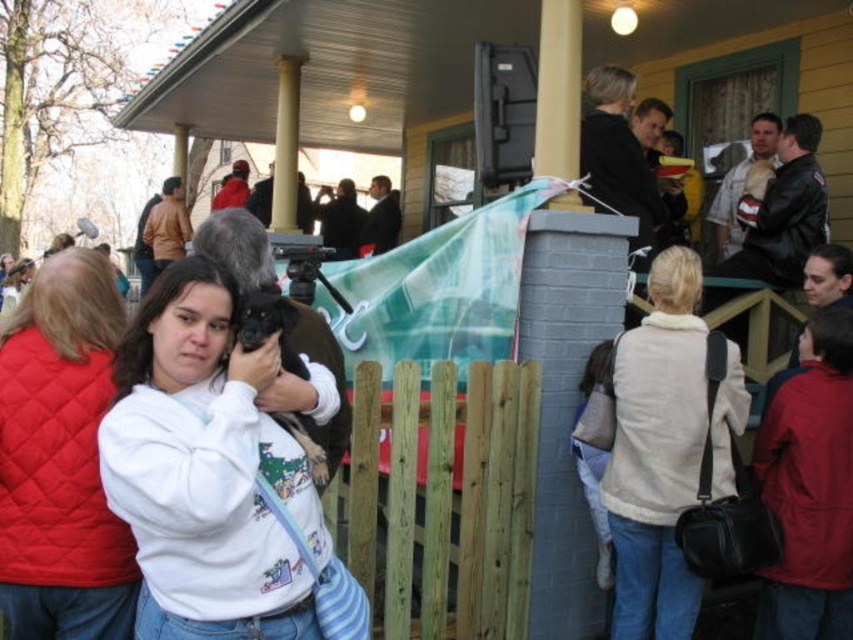
You are standing on the porch and want to see over the brown wooden fence at center to check the weather. Can you see over it using the white painted wood column at upper center as a reference point?

The brown wooden fence at center is not as tall as the white painted wood column at upper center. Since the column is taller, you can use it as a reference to determine that the fence is shorter, so you can see over the brown wooden fence at center.

You are standing on the porch and need to find the white quilted vest at center. According to the coordinates given, where should you look to locate it?

The white quilted vest at center is located at point 0.716 on the x axis and 0.072 on the y axis.

You are designing a layout for a porch decoration project and need to place both the white quilted vest at center and the white painted wood column at upper center. Given their sizes, which object should you prioritize placing first to ensure proper spacing?

The white quilted vest at center occupies less space than the white painted wood column at upper center, so you should prioritize placing the white painted wood column at upper center first to ensure proper spacing.